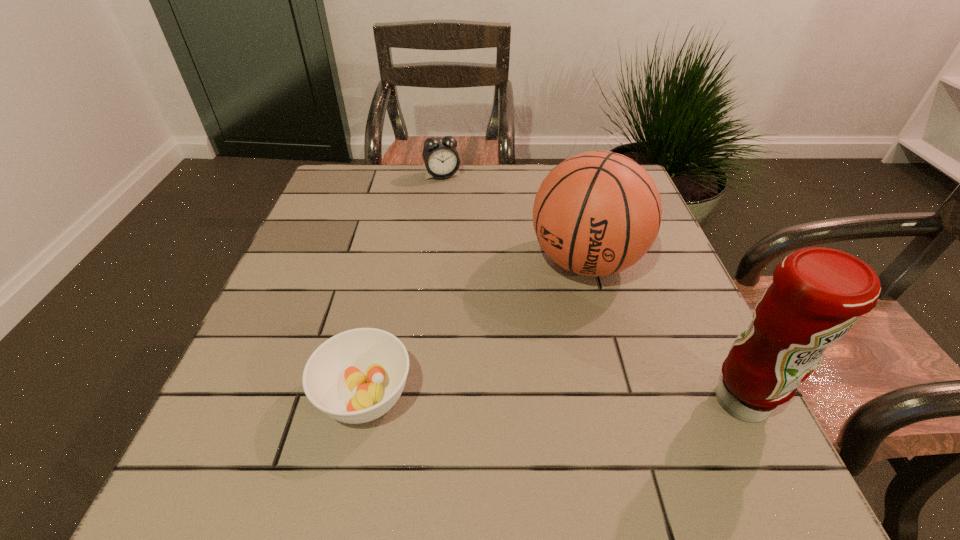
The height and width of the screenshot is (540, 960). I want to click on empty location between the shortest object and the third tallest object, so click(404, 286).

Find the location of `vacant space in between the soup bowl and the second shortest object`. vacant space in between the soup bowl and the second shortest object is located at coordinates (404, 286).

Locate an element on the screen. The height and width of the screenshot is (540, 960). free area in between the farthest object and the rightmost object is located at coordinates (591, 288).

Where is `empty space between the condiment and the alarm clock`? empty space between the condiment and the alarm clock is located at coordinates (591, 288).

At what (x,y) coordinates should I click in order to perform the action: click on free spot between the alarm clock and the shortest object. Please return your answer as a coordinate pair (x, y). Image resolution: width=960 pixels, height=540 pixels. Looking at the image, I should click on (x=404, y=286).

This screenshot has width=960, height=540. Find the location of `free space between the shortest object and the farthest object`. free space between the shortest object and the farthest object is located at coordinates (404, 286).

This screenshot has height=540, width=960. I want to click on free space that is in between the soup bowl and the condiment, so click(x=553, y=399).

At what (x,y) coordinates should I click in order to perform the action: click on vacant area between the basketball and the alarm clock. Please return your answer as a coordinate pair (x, y). Looking at the image, I should click on (514, 218).

Where is `object that ranks as the closest to the soup bowl`? This screenshot has width=960, height=540. object that ranks as the closest to the soup bowl is located at coordinates (597, 213).

Identify the location of the closest object to the second shortest object. This screenshot has width=960, height=540. (597, 213).